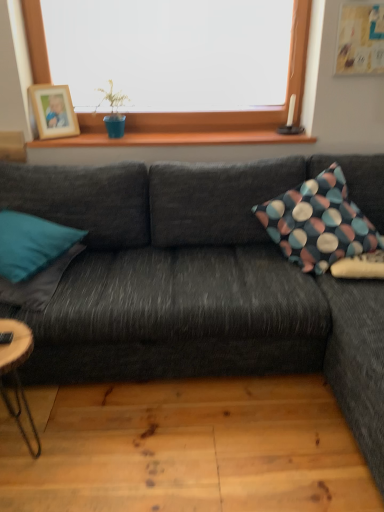
You are a GUI agent. You are given a task and a screenshot of the screen. Output one action in this format:
    pyautogui.click(x=<x>, y=<y>)
    Task: Click on the empty space that is ontop of wooden at upper center
    This screenshot has height=512, width=384.
    Given the screenshot: What is the action you would take?
    pyautogui.click(x=175, y=135)